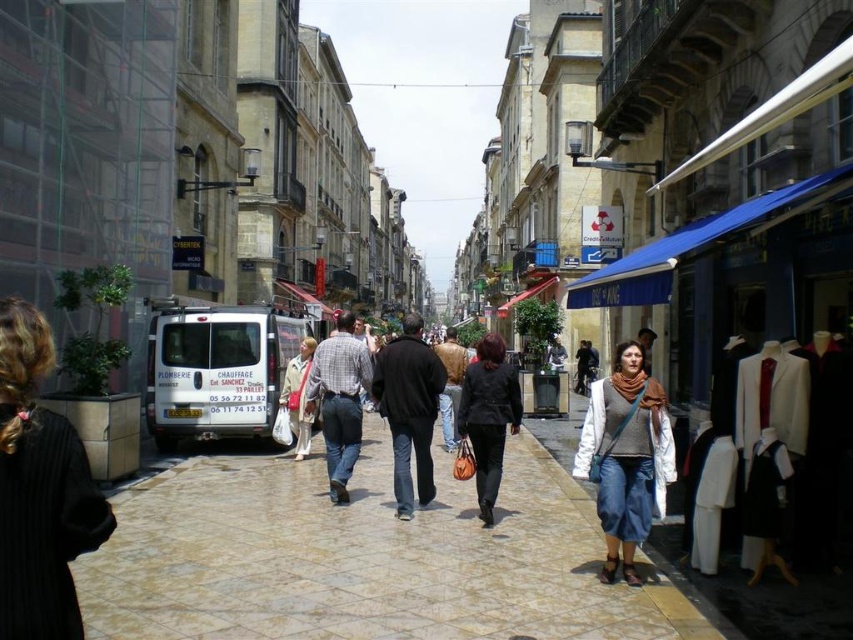
Question: Among these points, which one is farthest from the camera?

Choices:
 (A) click(x=440, y=410)
 (B) click(x=300, y=456)
 (C) click(x=65, y=445)
 (D) click(x=494, y=467)

Answer: (A)

Question: Can you confirm if black wool coat at lower left is positioned below black leather jacket at center?

Choices:
 (A) yes
 (B) no

Answer: (B)

Question: Which object is farther from the camera taking this photo?

Choices:
 (A) light beige stone pavement at center
 (B) leather jacket at center
 (C) black leather jacket at center
 (D) light beige coat at center

Answer: (D)

Question: Observing the image, what is the correct spatial positioning of plaid cotton shirt at center in reference to leather jacket at center?

Choices:
 (A) above
 (B) below

Answer: (B)

Question: Which object is farther from the camera taking this photo?

Choices:
 (A) light beige stone pavement at center
 (B) plaid cotton shirt at center
 (C) knit gray sweater at center

Answer: (B)

Question: Can you confirm if black wool coat at lower left is positioned to the left of plaid cotton shirt at center?

Choices:
 (A) no
 (B) yes

Answer: (B)